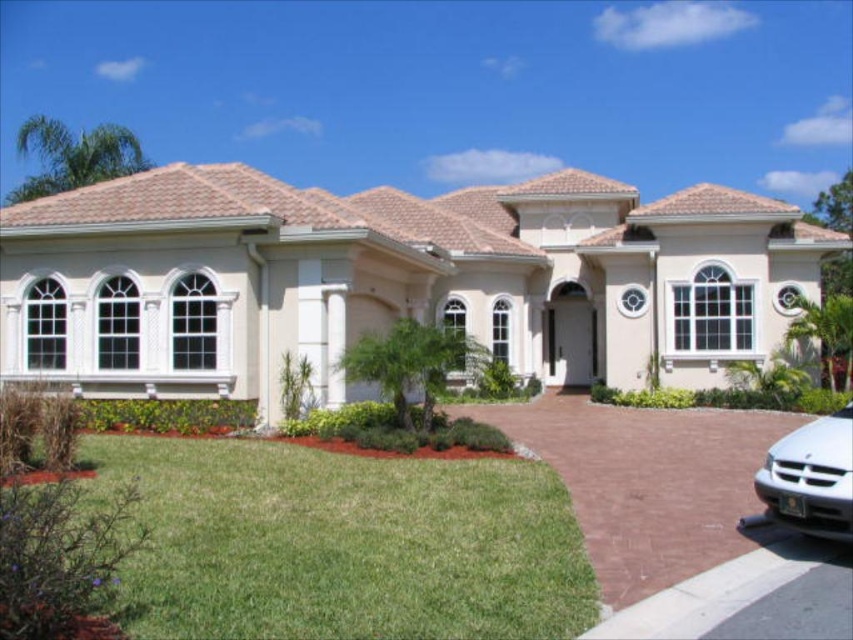
Question: Which point is farther to the camera?

Choices:
 (A) green grass at lower left
 (B) brown concrete driveway at lower right

Answer: (A)

Question: Which object is farther from the camera taking this photo?

Choices:
 (A) brown concrete driveway at lower right
 (B) green grass at lower left

Answer: (B)

Question: Does green grass at lower left appear under brown concrete driveway at lower right?

Choices:
 (A) no
 (B) yes

Answer: (A)

Question: Is green grass at lower left to the right of silver metallic sedan at lower right from the viewer's perspective?

Choices:
 (A) no
 (B) yes

Answer: (A)

Question: Can you confirm if brown concrete driveway at lower right is positioned below silver metallic sedan at lower right?

Choices:
 (A) yes
 (B) no

Answer: (A)

Question: Which of the following is the farthest from the observer?

Choices:
 (A) silver metallic sedan at lower right
 (B) brown concrete driveway at lower right
 (C) green grass at lower left

Answer: (C)